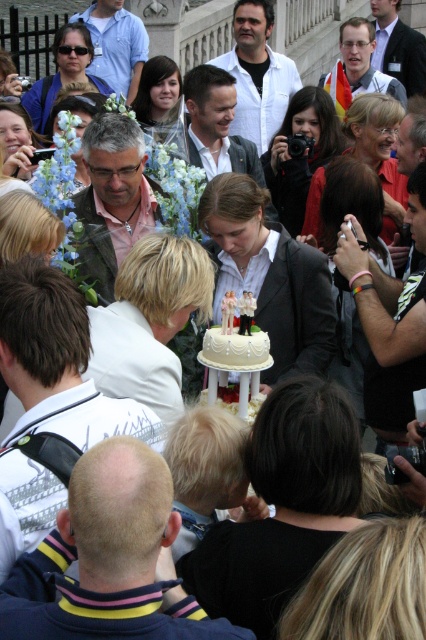
You are a photographer at the wedding reception and need to take a photo of the white shirt at center and the white fondant cake at center. Which one is taller?

The white shirt at center is much taller than the white fondant cake at center.

Consider the image. You are a photographer at the wedding. You need to capture a photo of the white matte shirt at center and the matte black jacket at upper center. Can you tell me which one is positioned lower in the frame?

The white matte shirt at center is positioned below the matte black jacket at upper center, so it is lower in the frame.

Consider the image. You are standing at the viewer position and want to hand a gift to the person wearing the white matte shirt at center. Can you reach them directly without moving from your current position?

The distance between you and the white matte shirt at center is 61.04 meters, which is too far to reach directly without moving closer. You would need to approach them to hand over the gift.